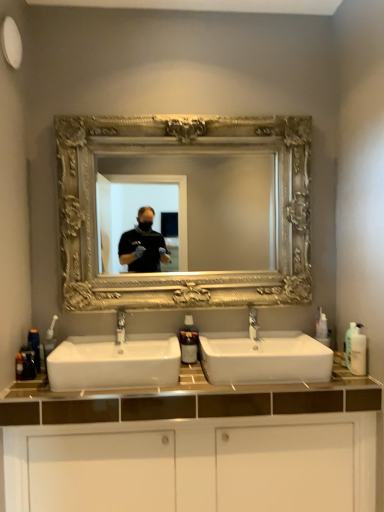
Identify the location of silver metallic tap at center, which is the first tap in right-to-left order. (253, 323).

This screenshot has height=512, width=384. What do you see at coordinates (196, 446) in the screenshot? I see `white glossy cabinet at lower center` at bounding box center [196, 446].

Describe the element at coordinates (35, 346) in the screenshot. I see `blue plastic bottle at lower left, which is the third toiletry from right to left` at that location.

The width and height of the screenshot is (384, 512). I want to click on white ceramic sink at center, marked as the second sink in a left-to-right arrangement, so click(x=263, y=357).

Where is `silver metallic tap at center, which is the first tap in right-to-left order`? The image size is (384, 512). silver metallic tap at center, which is the first tap in right-to-left order is located at coordinates (253, 323).

At what (x,y) coordinates should I click in order to perform the action: click on toiletry that is the 3rd one when counting backward from the white ceramic sink at center, marked as the second sink in a left-to-right arrangement. Please return your answer as a coordinate pair (x, y). Looking at the image, I should click on (35, 346).

In the image, is blue plastic bottle at lower left, the 1th toiletry when ordered from left to right, positioned in front of or behind white ceramic sink at center, which is the first sink in right-to-left order?

Visually, blue plastic bottle at lower left, the 1th toiletry when ordered from left to right, is located behind white ceramic sink at center, which is the first sink in right-to-left order.

Does blue plastic bottle at lower left, which is the third toiletry from right to left, have a lesser width compared to white ceramic sink at center, marked as the second sink in a left-to-right arrangement?

Yes.

Could you measure the distance between blue plastic bottle at lower left, which is the third toiletry from right to left, and white ceramic sink at center, which is the first sink in right-to-left order?

38.24 inches.

Is point (255, 316) closer or farther from the camera than point (276, 302)?

Clearly, point (255, 316) is closer to the camera than point (276, 302).

From their relative heights in the image, would you say silver metallic tap at center, which is the first tap in right-to-left order, is taller or shorter than gold ornate mirror at center?

silver metallic tap at center, which is the first tap in right-to-left order, is shorter than gold ornate mirror at center.

Which object is more forward, silver metallic tap at center, which is the first tap in right-to-left order, or gold ornate mirror at center?

Positioned in front is gold ornate mirror at center.

Is translucent plastic soap dispenser at center oriented away from blue plastic bottle at lower left, which is the third toiletry from right to left?

translucent plastic soap dispenser at center does not have its back to blue plastic bottle at lower left, which is the third toiletry from right to left.

From a real-world perspective, is translucent plastic soap dispenser at center above or below blue plastic bottle at lower left, which is the third toiletry from right to left?

In terms of real-world spatial position, translucent plastic soap dispenser at center is above blue plastic bottle at lower left, which is the third toiletry from right to left.

Which object is closer to the camera taking this photo, translucent plastic soap dispenser at center or blue plastic bottle at lower left, the 1th toiletry when ordered from left to right?

blue plastic bottle at lower left, the 1th toiletry when ordered from left to right.

Is point (184, 350) more distant than point (39, 343)?

Yes, it is behind point (39, 343).

From the image's perspective, does blue plastic bottle at lower left, which is the third toiletry from right to left, appear lower than gold ornate mirror at center?

Yes.

Is there a large distance between blue plastic bottle at lower left, the 1th toiletry when ordered from left to right, and gold ornate mirror at center?

That's not correct — blue plastic bottle at lower left, the 1th toiletry when ordered from left to right, is a little close to gold ornate mirror at center.

Is translucent plastic soap dispenser at center taller than white ceramic sink at center, acting as the 1th sink starting from the left?

Yes, translucent plastic soap dispenser at center is taller than white ceramic sink at center, acting as the 1th sink starting from the left.

Does translucent plastic soap dispenser at center appear on the right side of white ceramic sink at center, which is the 2th sink in right-to-left order?

Indeed, translucent plastic soap dispenser at center is positioned on the right side of white ceramic sink at center, which is the 2th sink in right-to-left order.

From the image's perspective, is translucent plastic soap dispenser at center located beneath white ceramic sink at center, acting as the 1th sink starting from the left?

No, from the image's perspective, translucent plastic soap dispenser at center is not below white ceramic sink at center, acting as the 1th sink starting from the left.

From a real-world perspective, which is physically above, translucent plastic soap dispenser at center or white ceramic sink at center, which is the 2th sink in right-to-left order?

translucent plastic soap dispenser at center is physically above.

Consider the image. Is translucent plastic bottle at lower left, the second toiletry when ordered from right to left, shorter than translucent plastic soap dispenser at center?

Correct, translucent plastic bottle at lower left, the second toiletry when ordered from right to left, is not as tall as translucent plastic soap dispenser at center.

Which is nearer, (x=22, y=376) or (x=181, y=336)?

The point (x=22, y=376) is more forward.

From a real-world perspective, which object stands above the other?

translucent plastic soap dispenser at center is physically above.

Between translucent plastic bottle at lower left, the second toiletry when ordered from right to left, and translucent plastic soap dispenser at center, which one has smaller width?

translucent plastic bottle at lower left, the second toiletry when ordered from right to left, is thinner.

Is white ceramic sink at center, which is the 2th sink in right-to-left order, positioned far away from white glossy cabinet at lower center?

No, white ceramic sink at center, which is the 2th sink in right-to-left order, is not far from white glossy cabinet at lower center.

Between white ceramic sink at center, which is the 2th sink in right-to-left order, and white glossy cabinet at lower center, which one is positioned behind?

Positioned behind is white ceramic sink at center, which is the 2th sink in right-to-left order.

Is point (162, 342) less distant than point (162, 489)?

No, (162, 342) is further to viewer.

Image resolution: width=384 pixels, height=512 pixels. Find the location of `the 1st sink positioned below the blue plastic bottle at lower left, which is the third toiletry from right to left (from a real-world perspective)`. the 1st sink positioned below the blue plastic bottle at lower left, which is the third toiletry from right to left (from a real-world perspective) is located at coordinates point(263,357).

Identify the location of picture frame lying above the silver metallic tap at center, which is the 2th tap from left to right (from the image's perspective). The width and height of the screenshot is (384, 512). (182, 152).

When comparing their distances from matte silver faucet at center, which is the 1th tap in left-to-right order, does white plastic bottle at right, the 1th toiletry in the right-to-left sequence, or white ceramic sink at center, which is the 2th sink in right-to-left order, seem closer?

white ceramic sink at center, which is the 2th sink in right-to-left order, is closer to matte silver faucet at center, which is the 1th tap in left-to-right order.

Considering their positions, is gold ornate mirror at center positioned further to translucent plastic soap dispenser at center than matte silver faucet at center, acting as the 2th tap starting from the right?

The object further to translucent plastic soap dispenser at center is gold ornate mirror at center.

Based on their spatial positions, is white ceramic sink at center, acting as the 1th sink starting from the left, or translucent plastic soap dispenser at center further from gold ornate mirror at center?

The object further to gold ornate mirror at center is translucent plastic soap dispenser at center.

From the image, which object appears to be farther from silver metallic tap at center, which is the 2th tap from left to right, white plastic bottle at right, arranged as the 3th toiletry when viewed from the left, or blue plastic bottle at lower left, which is the third toiletry from right to left?

The object further to silver metallic tap at center, which is the 2th tap from left to right, is blue plastic bottle at lower left, which is the third toiletry from right to left.

Which object lies further to the anchor point white ceramic sink at center, which is the first sink in right-to-left order, translucent plastic soap dispenser at center or blue plastic bottle at lower left, the 1th toiletry when ordered from left to right?

blue plastic bottle at lower left, the 1th toiletry when ordered from left to right, is positioned further to the anchor white ceramic sink at center, which is the first sink in right-to-left order.

Which object lies further to the anchor point translucent plastic soap dispenser at center, translucent plastic bottle at lower left, the second toiletry when ordered from right to left, or white ceramic sink at center, which is the first sink in right-to-left order?

Among the two, translucent plastic bottle at lower left, the second toiletry when ordered from right to left, is located further to translucent plastic soap dispenser at center.

From the image, which object appears to be farther from blue plastic bottle at lower left, which is the third toiletry from right to left, white plastic bottle at right, the 1th toiletry in the right-to-left sequence, or gold ornate mirror at center?

white plastic bottle at right, the 1th toiletry in the right-to-left sequence, is positioned further to the anchor blue plastic bottle at lower left, which is the third toiletry from right to left.

Which object lies further to the anchor point white plastic bottle at right, arranged as the 3th toiletry when viewed from the left, blue plastic bottle at lower left, the 1th toiletry when ordered from left to right, or matte silver faucet at center, acting as the 2th tap starting from the right?

blue plastic bottle at lower left, the 1th toiletry when ordered from left to right, is further to white plastic bottle at right, arranged as the 3th toiletry when viewed from the left.

This screenshot has height=512, width=384. I want to click on toiletry between blue plastic bottle at lower left, which is the third toiletry from right to left, and translucent plastic soap dispenser at center from left to right, so click(28, 364).

At what (x,y) coordinates should I click in order to perform the action: click on sink between white glossy cabinet at lower center and white plastic bottle at right, the 1th toiletry in the right-to-left sequence, from left to right. Please return your answer as a coordinate pair (x, y). This screenshot has height=512, width=384. Looking at the image, I should click on (263, 357).

I want to click on bathroom cabinet situated between white ceramic sink at center, which is the 2th sink in right-to-left order, and white ceramic sink at center, marked as the second sink in a left-to-right arrangement, from left to right, so click(x=196, y=446).

Find the location of `soap dispenser between translucent plastic bottle at lower left, placed as the 2th toiletry when sorted from left to right, and white glossy cabinet at lower center from left to right`. soap dispenser between translucent plastic bottle at lower left, placed as the 2th toiletry when sorted from left to right, and white glossy cabinet at lower center from left to right is located at coordinates (189, 341).